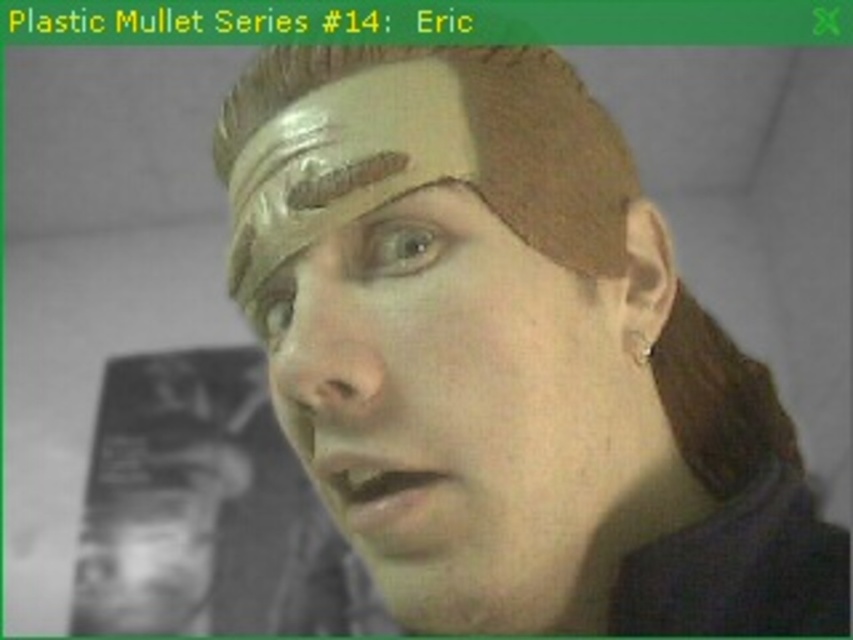
You are an artist analyzing the Plastic Mullet Series. In the image, you see a brown matte eye at center and a matte gold eyebrow at upper center. Which object is taller?

The brown matte eye at center has a greater height compared to the matte gold eyebrow at upper center, so the brown matte eye at center is taller.

In the scene shown: You are an interior designer planning to place a decorative item between the smooth plastic head at lower left and the brown matte eye at center. The item is 3 feet wide. Will there be enough space between them to fit the item without overlapping?

The smooth plastic head at lower left is 6.68 feet from the brown matte eye at center. Since the item is 3 feet wide, there is sufficient space between them to fit the item without overlapping.

You are an artist trying to paint this scene. You want to place a highlight on the object that is in front. Which object should you add the highlight to, the smooth plastic head at lower left or the brown matte eye at center?

The smooth plastic head at lower left is in front of the brown matte eye at center, so you should add the highlight to the smooth plastic head at lower left.